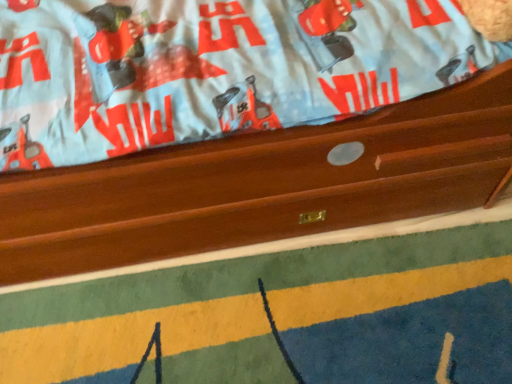
Image resolution: width=512 pixels, height=384 pixels. I want to click on wooden bed frame at upper center, so click(x=261, y=185).

Image resolution: width=512 pixels, height=384 pixels. Describe the element at coordinates (261, 185) in the screenshot. I see `wooden bed frame at upper center` at that location.

The width and height of the screenshot is (512, 384). Find the location of `wooden bed frame at upper center`. wooden bed frame at upper center is located at coordinates (261, 185).